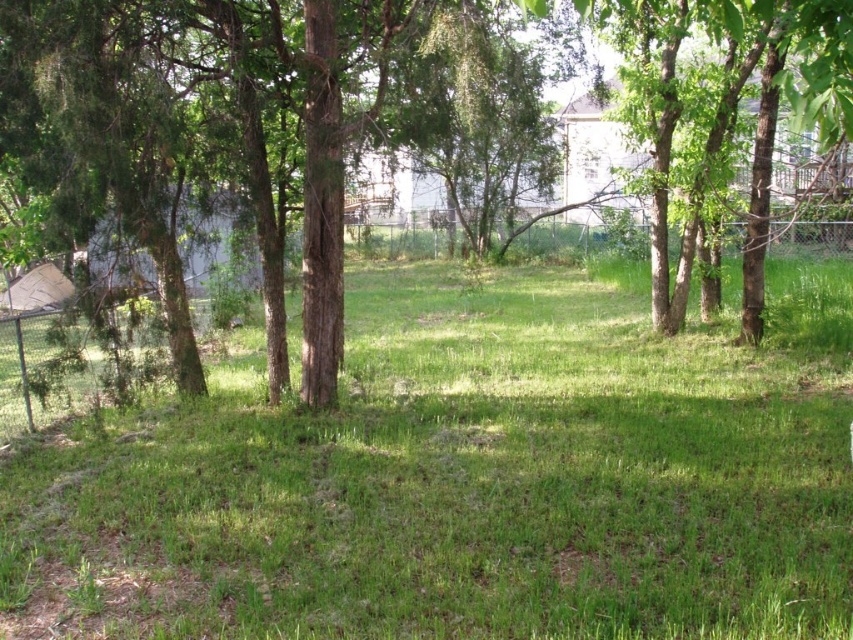
Question: Which of the following is the farthest from the observer?

Choices:
 (A) (299, 490)
 (B) (326, 109)

Answer: (B)

Question: Which object appears closest to the camera in this image?

Choices:
 (A) green grassy at center
 (B) green leafy tree at center

Answer: (A)

Question: Which object appears farthest from the camera in this image?

Choices:
 (A) green leafy tree at center
 (B) green grassy at center

Answer: (A)

Question: In this image, where is green grassy at center located relative to green leafy tree at center?

Choices:
 (A) left
 (B) right

Answer: (B)

Question: Does green grassy at center have a larger size compared to green leafy tree at center?

Choices:
 (A) yes
 (B) no

Answer: (A)

Question: Observing the image, what is the correct spatial positioning of green grassy at center in reference to green leafy tree at center?

Choices:
 (A) above
 (B) below

Answer: (B)